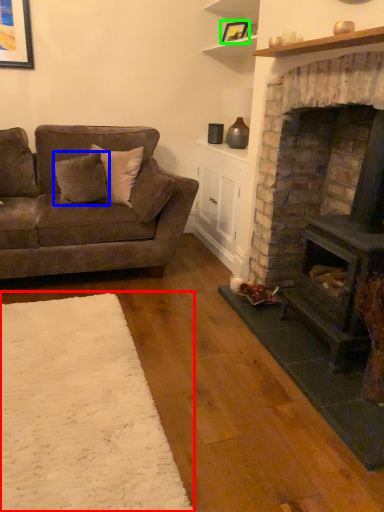
Question: Which object is positioned farthest from plain (highlighted by a red box)? Select from pillow (highlighted by a blue box) and picture frame (highlighted by a green box).

Choices:
 (A) pillow
 (B) picture frame

Answer: (B)